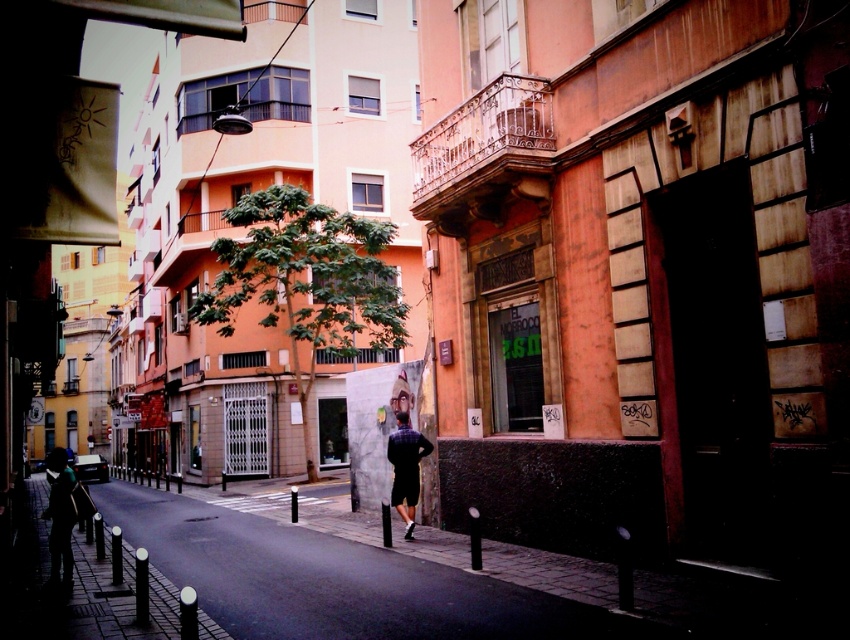
Question: Among these objects, which one is farthest from the camera?

Choices:
 (A) paved stone sidewalk at center
 (B) silhouette figure at left

Answer: (B)

Question: Is silhouette figure at left positioned at the back of plaid fabric shirt at center?

Choices:
 (A) yes
 (B) no

Answer: (B)

Question: Which object is the closest to the plaid fabric shirt at center?

Choices:
 (A) silhouette figure at left
 (B) paved stone sidewalk at center

Answer: (B)

Question: Which object appears closest to the camera in this image?

Choices:
 (A) plaid fabric shirt at center
 (B) paved stone sidewalk at center

Answer: (B)

Question: Does paved stone sidewalk at center have a larger size compared to silhouette figure at left?

Choices:
 (A) yes
 (B) no

Answer: (A)

Question: From the image, what is the correct spatial relationship of silhouette figure at left in relation to plaid fabric shirt at center?

Choices:
 (A) left
 (B) right

Answer: (A)